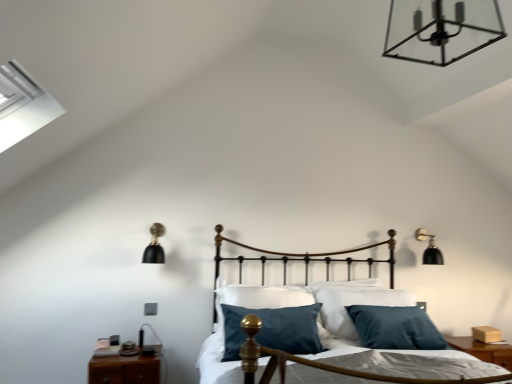
Question: Can you confirm if brown wood nightstand at lower left, positioned as the 2th nightstand in back-to-front order, is smaller than black matte wall sconce at left, which is counted as the 2th lamp, starting from the front?

Choices:
 (A) no
 (B) yes

Answer: (A)

Question: Would you say brown wood nightstand at lower left, positioned as the 1th nightstand in left-to-right order, is a long distance from black matte wall sconce at left, the second lamp when ordered from top to bottom?

Choices:
 (A) no
 (B) yes

Answer: (A)

Question: Can we say brown wood nightstand at lower left, the second nightstand positioned from the right, lies outside black matte wall sconce at left, the second lamp when ordered from top to bottom?

Choices:
 (A) no
 (B) yes

Answer: (B)

Question: Is brown wood nightstand at lower left, positioned as the 1th nightstand in left-to-right order, looking in the opposite direction of black matte wall sconce at left, the second lamp when ordered from top to bottom?

Choices:
 (A) no
 (B) yes

Answer: (A)

Question: Can you confirm if brown wood nightstand at lower left, positioned as the 1th nightstand in left-to-right order, is shorter than black matte wall sconce at left, the second lamp when ordered from top to bottom?

Choices:
 (A) no
 (B) yes

Answer: (B)

Question: Considering the positions of gold polished metal bed frame at center and brown wood nightstand at lower right, placed as the first nightstand when sorted from back to front, in the image, is gold polished metal bed frame at center wider or thinner than brown wood nightstand at lower right, placed as the first nightstand when sorted from back to front,?

Choices:
 (A) thin
 (B) wide

Answer: (B)

Question: From a real-world perspective, is gold polished metal bed frame at center physically located above or below brown wood nightstand at lower right, the 2th nightstand from the left?

Choices:
 (A) below
 (B) above

Answer: (B)

Question: Does point (342, 377) appear closer or farther from the camera than point (499, 360)?

Choices:
 (A) closer
 (B) farther

Answer: (A)

Question: Based on their positions, is gold polished metal bed frame at center located to the left or right of brown wood nightstand at lower right, placed as the first nightstand when sorted from back to front?

Choices:
 (A) left
 (B) right

Answer: (A)

Question: Considering their positions, is gold polished metal bed frame at center located in front of or behind brown wood nightstand at lower left, which ranks as the first nightstand in front-to-back order?

Choices:
 (A) behind
 (B) front

Answer: (B)

Question: Considering the relative positions of gold polished metal bed frame at center and brown wood nightstand at lower left, the second nightstand positioned from the right, in the image provided, is gold polished metal bed frame at center to the left or to the right of brown wood nightstand at lower left, the second nightstand positioned from the right,?

Choices:
 (A) left
 (B) right

Answer: (B)

Question: From a real-world perspective, relative to brown wood nightstand at lower left, positioned as the 2th nightstand in back-to-front order, is gold polished metal bed frame at center vertically above or below?

Choices:
 (A) below
 (B) above

Answer: (B)

Question: Is gold polished metal bed frame at center bigger or smaller than brown wood nightstand at lower left, the second nightstand positioned from the right?

Choices:
 (A) small
 (B) big

Answer: (B)

Question: From the image's perspective, relative to gold polished metal bed frame at center, is black matte wall sconce at right, the 1th lamp positioned from the right, above or below?

Choices:
 (A) below
 (B) above

Answer: (B)

Question: In terms of width, does black matte wall sconce at right, placed as the 1th lamp when sorted from bottom to top, look wider or thinner when compared to gold polished metal bed frame at center?

Choices:
 (A) wide
 (B) thin

Answer: (B)